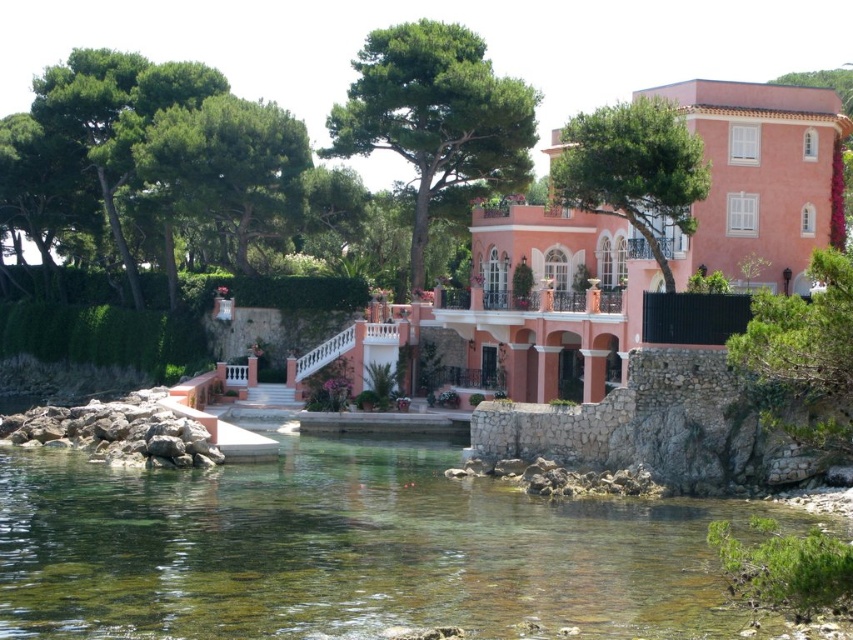
Please use the coordinates provided to determine the exact position of the green leafy tree at center in the image. What are its coordinates?

The green leafy tree at center is located at coordinates point (436, 120).

Looking at this image, you are a landscape architect designing a garden for the pink stucco villa at center and the green leafy tree at center. Which structure is wider?

The pink stucco villa at center is wider than the green leafy tree at center because the pink stucco villa at center has a greater width as stated in the description.

You are a landscape architect designing a new garden for the property. The client wants to ensure that the pink stucco villa at center remains visible from the main walkway. Considering the green leafy tree at upper right, what should you advise about its placement?

The pink stucco villa at center is shorter than the green leafy tree at upper right. To keep the villa visible from the walkway, the tree should be positioned so it does not block the view, perhaps by placing it further away or pruning it to maintain a lower height.